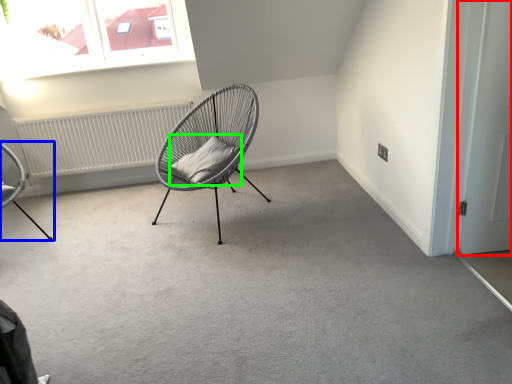
Question: Estimate the real-world distances between objects in this image. Which object is closer to door (highlighted by a red box), chair (highlighted by a blue box) or pillow (highlighted by a green box)?

Choices:
 (A) chair
 (B) pillow

Answer: (B)